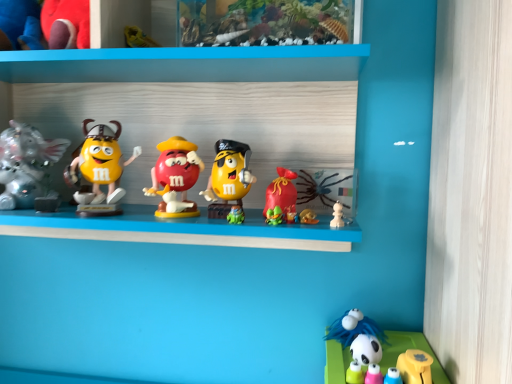
Question: From a real-world perspective, is matte plastic m&m figure at center, the fourth toy when ordered from left to right, positioned above or below silver metallic elephant at left, the 2th toy when ordered from left to right?

Choices:
 (A) above
 (B) below

Answer: (B)

Question: Is matte plastic m&m figure at center, the fourth toy when ordered from left to right, situated inside silver metallic elephant at left, which is the 6th toy from right to left, or outside?

Choices:
 (A) inside
 (B) outside

Answer: (B)

Question: Which object is the farthest from the matte plastic m&m figure at center, arranged as the 4th toy when viewed from the right?

Choices:
 (A) yellow plastic toy at lower right, which appears as the seventh toy when viewed from the left
 (B) silver metallic elephant at left, the 2th toy when ordered from left to right
 (C) velvet plush toy at upper left, which appears as the 1th toy when viewed from the left
 (D) white glossy panda at lower right
 (E) white matte panda at lower right, the 6th toy positioned from the left

Answer: (A)

Question: Which is nearer to the white matte panda at lower right, the 6th toy positioned from the left?

Choices:
 (A) yellow plastic toy at lower right, which appears as the seventh toy when viewed from the left
 (B) silver metallic elephant at left, which is the 6th toy from right to left
 (C) velvet plush toy at upper left, which appears as the 1th toy when viewed from the left
 (D) matte yellow figurine at left, acting as the third toy starting from the left
 (E) white glossy panda at lower right

Answer: (E)